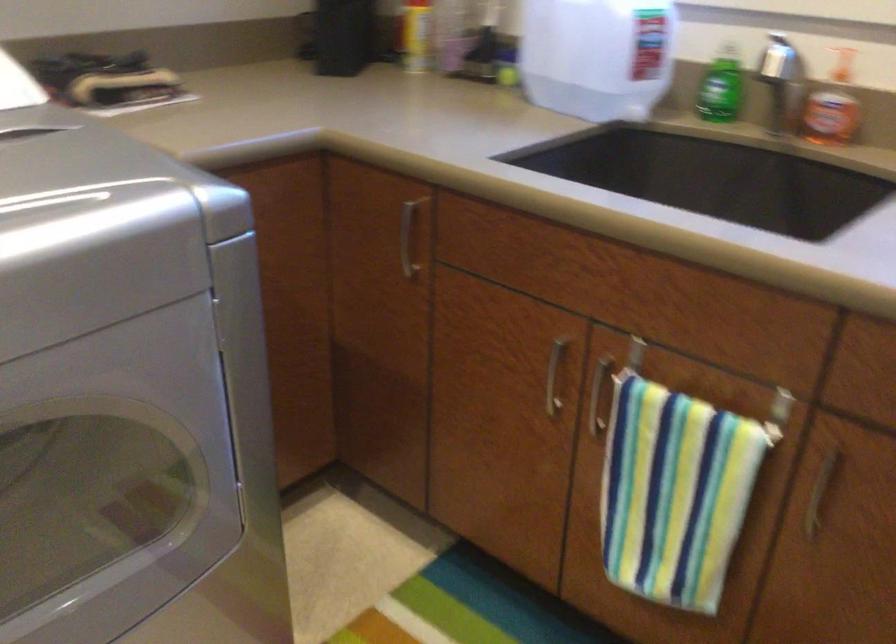
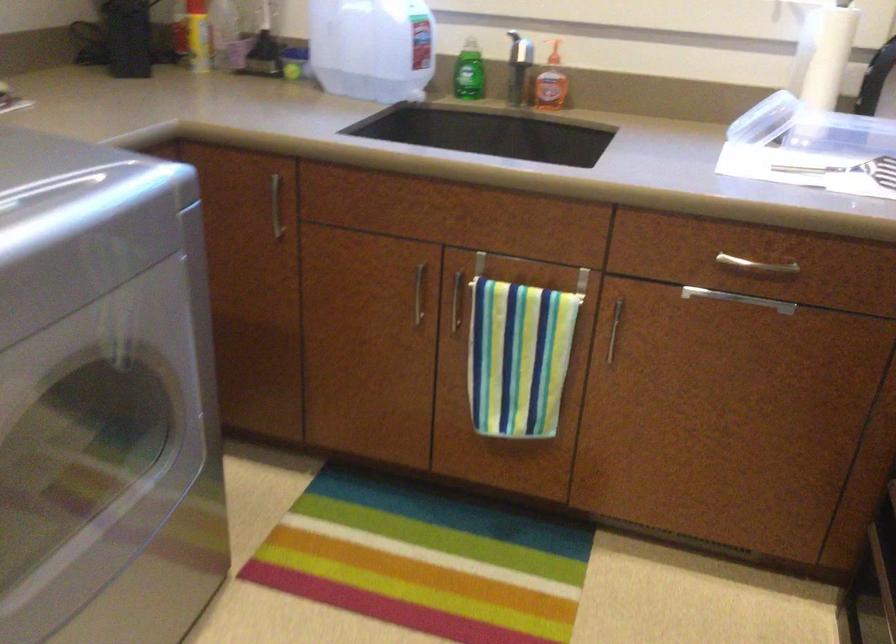
Question: How did the camera likely rotate?

Choices:
 (A) Left
 (B) Right
 (C) Up
 (D) Down

Answer: (B)